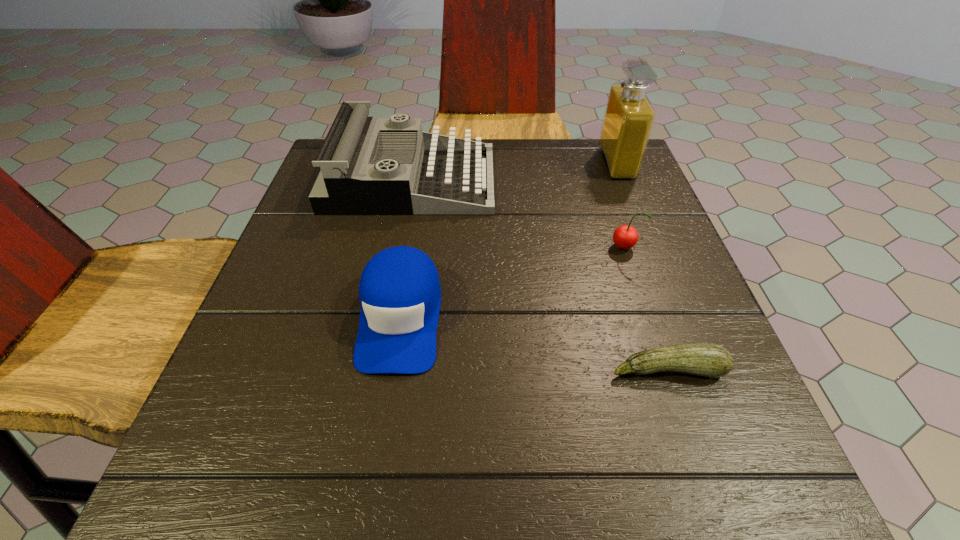
Where is `vacant region located on the front-facing side of the baseball cap`? This screenshot has height=540, width=960. vacant region located on the front-facing side of the baseball cap is located at coordinates (371, 504).

This screenshot has width=960, height=540. What are the coordinates of `vacant space situated at the stem end of the zucchini` in the screenshot? It's located at (684, 415).

This screenshot has height=540, width=960. Identify the location of perfume present at the far edge. (629, 116).

You are a GUI agent. You are given a task and a screenshot of the screen. Output one action in this format:
    pyautogui.click(x=<x>, y=<y>)
    Task: Click on the typewriter located at the far edge
    
    Given the screenshot: What is the action you would take?
    pyautogui.click(x=369, y=165)

Identify the location of object that is at the left edge. The image size is (960, 540). (369, 165).

Where is `perfume located in the right edge section of the desktop`? The width and height of the screenshot is (960, 540). perfume located in the right edge section of the desktop is located at coordinates (629, 116).

You are a GUI agent. You are given a task and a screenshot of the screen. Output one action in this format:
    pyautogui.click(x=<x>, y=<y>)
    Task: Click on the cherry that is at the right edge
    
    Given the screenshot: What is the action you would take?
    click(x=625, y=237)

Find the location of `zucchini that is at the right edge`. zucchini that is at the right edge is located at coordinates coord(704,359).

This screenshot has width=960, height=540. I want to click on object at the far left corner, so click(x=369, y=165).

I want to click on object present at the far right corner, so click(x=629, y=116).